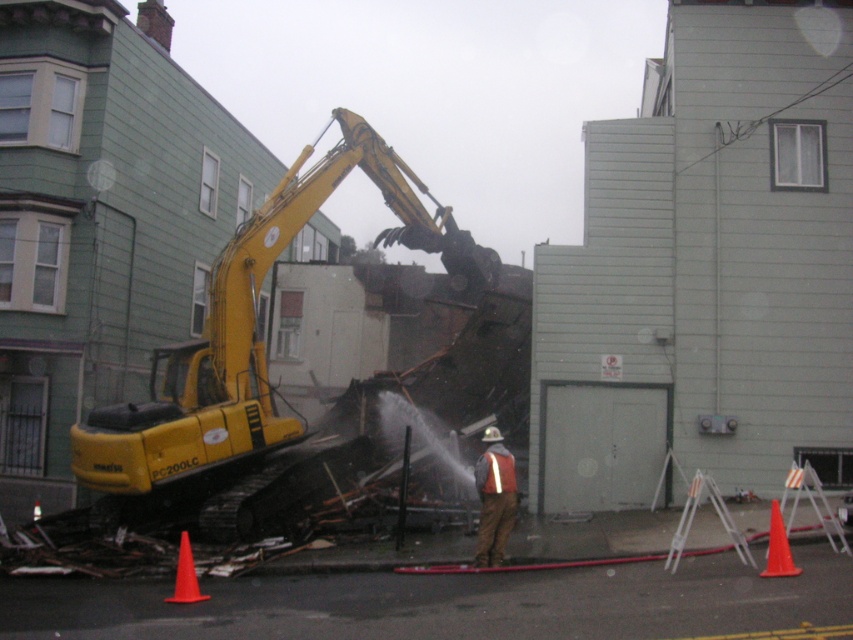
Is orange matte traffic cone at lower right bigger than orange matte traffic cone at lower left?

Incorrect, orange matte traffic cone at lower right is not larger than orange matte traffic cone at lower left.

Describe the element at coordinates (778, 547) in the screenshot. This screenshot has height=640, width=853. I see `orange matte traffic cone at lower right` at that location.

Does point (775, 544) lie behind point (186, 552)?

No, (775, 544) is closer to viewer.

Identify the location of orange matte traffic cone at lower right. (778, 547).

Is yellow metallic excavator at center in front of orange matte traffic cone at lower left?

That is False.

The image size is (853, 640). I want to click on yellow metallic excavator at center, so click(248, 339).

Looking at this image, can you confirm if reflective orange vest at center is taller than reflective fabric safety vest at center?

Indeed, reflective orange vest at center has a greater height compared to reflective fabric safety vest at center.

Between point (485, 518) and point (500, 458), which one is positioned in front?

Point (485, 518)

This screenshot has height=640, width=853. I want to click on reflective orange vest at center, so [x=494, y=499].